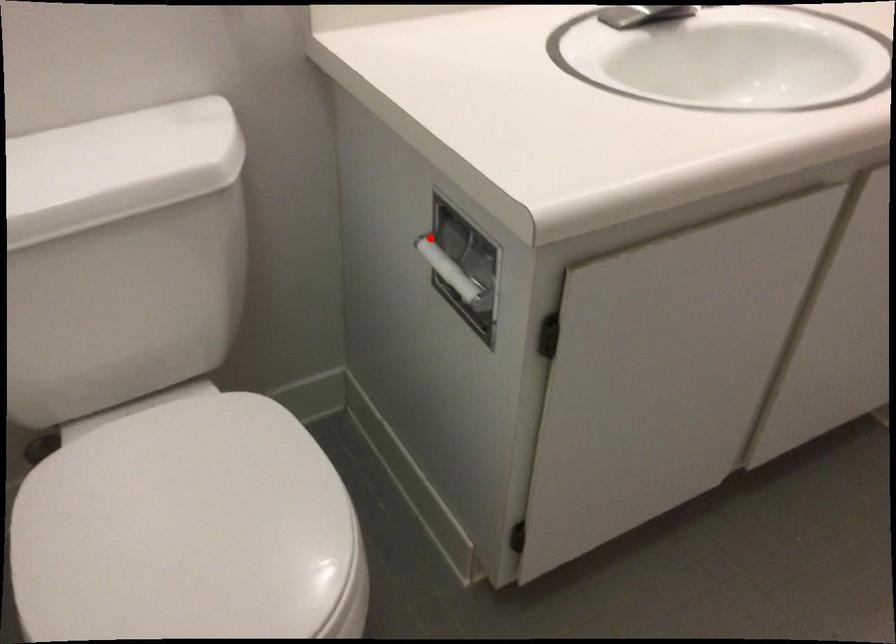
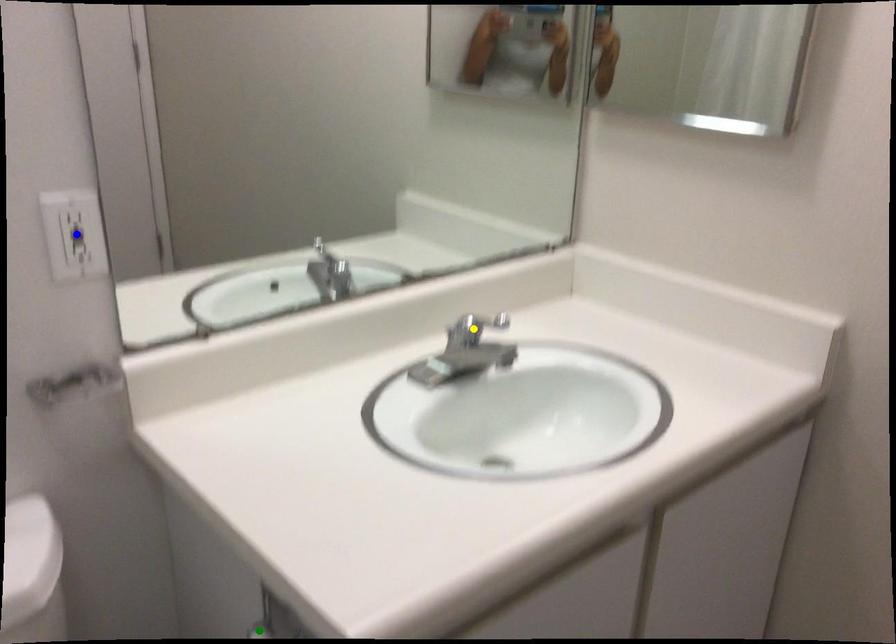
Question: I am providing you with two images of the same scene from different viewpoints. A red point is marked on the first image. You are given multiple points on the second image. Which point in image 2 is actually the same real-world point as the red point in image 1?

Choices:
 (A) blue point
 (B) yellow point
 (C) green point

Answer: (C)